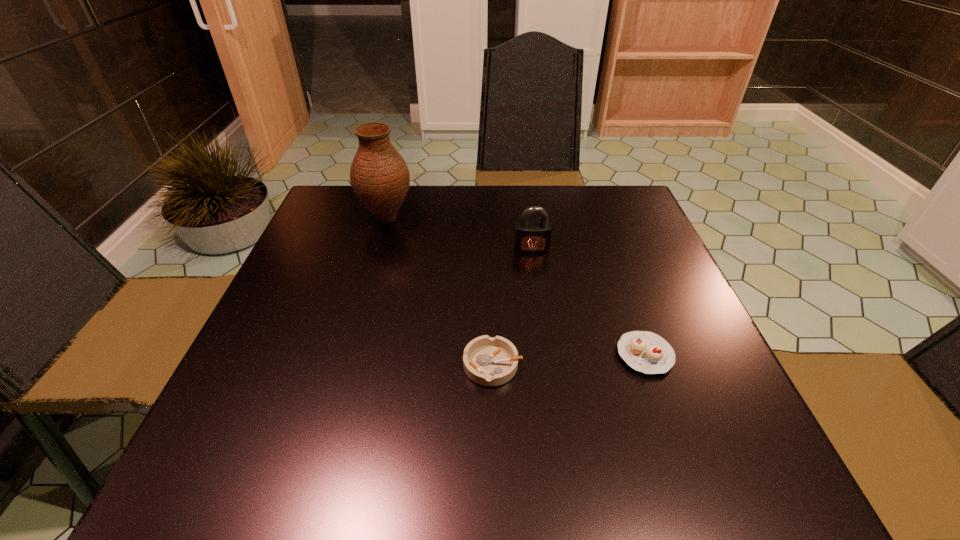
Where is `vacant position at the far right corner of the desktop`? This screenshot has height=540, width=960. vacant position at the far right corner of the desktop is located at coordinates (599, 201).

Where is `vacant area that lies between the tallest object and the cupcake`? The width and height of the screenshot is (960, 540). vacant area that lies between the tallest object and the cupcake is located at coordinates (516, 286).

I want to click on vacant space that's between the rightmost object and the shortest object, so click(569, 360).

You are a GUI agent. You are given a task and a screenshot of the screen. Output one action in this format:
    pyautogui.click(x=<x>, y=<y>)
    Task: Click on the unoccupied position between the third tallest object and the leftmost object
    The image size is (960, 540).
    Given the screenshot: What is the action you would take?
    pyautogui.click(x=516, y=286)

Find the location of `vacant area that lies between the rightmost object and the third object from left to right`. vacant area that lies between the rightmost object and the third object from left to right is located at coordinates (588, 301).

This screenshot has height=540, width=960. I want to click on vacant space that is in between the vase and the shortest object, so click(x=440, y=292).

This screenshot has width=960, height=540. In order to click on vacant region between the third object from right to left and the second object from right to left in this screenshot , I will do `click(512, 307)`.

I want to click on free space between the second object from left to right and the third shortest object, so click(x=512, y=307).

Where is `free space that is in between the leftmost object and the rightmost object`? free space that is in between the leftmost object and the rightmost object is located at coordinates (516, 286).

Where is `free space between the second shortest object and the vase`? This screenshot has width=960, height=540. free space between the second shortest object and the vase is located at coordinates (516, 286).